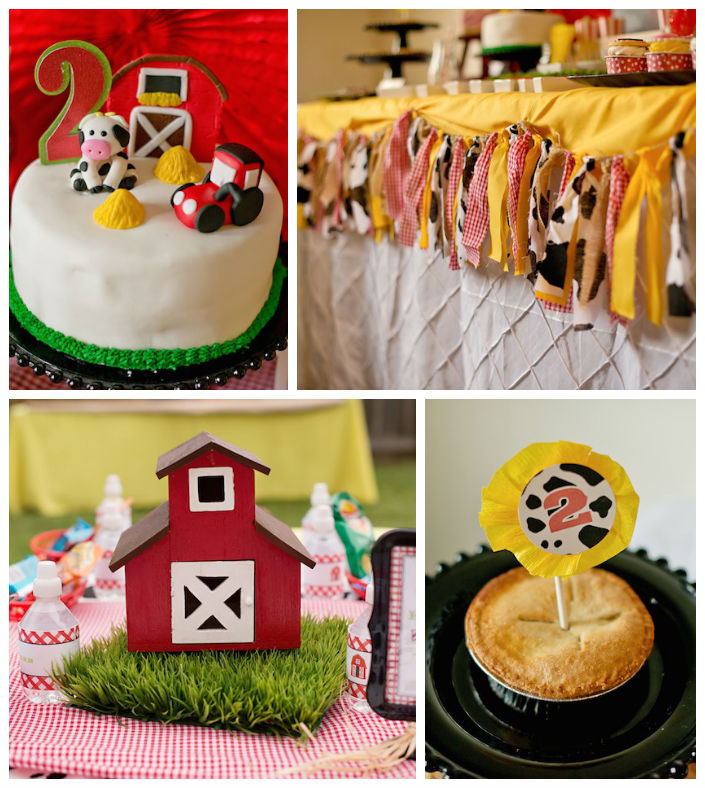
The height and width of the screenshot is (788, 705). Find the location of `yellow table cloth`. yellow table cloth is located at coordinates (570, 112).